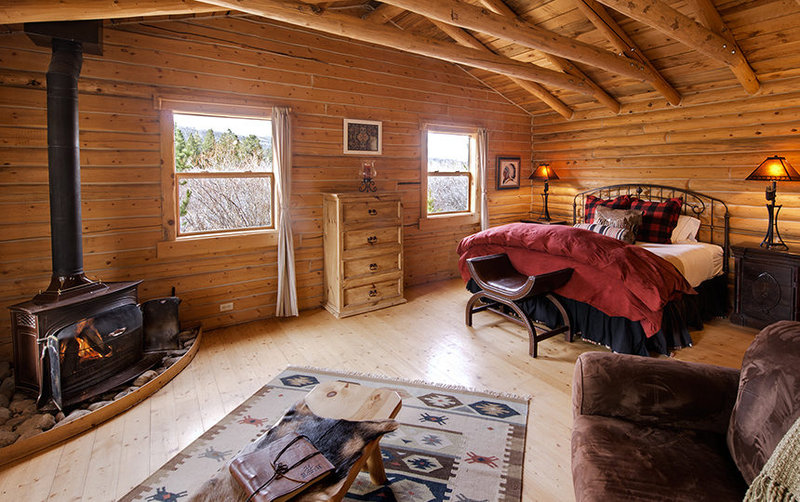
Where is `windows`? The image size is (800, 502). windows is located at coordinates (226, 160), (453, 160).